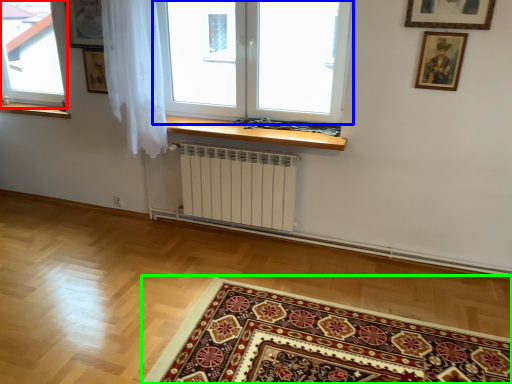
Question: Considering the real-world distances, which object is farthest from window (highlighted by a red box)? window (highlighted by a blue box) or mat (highlighted by a green box)?

Choices:
 (A) window
 (B) mat

Answer: (B)